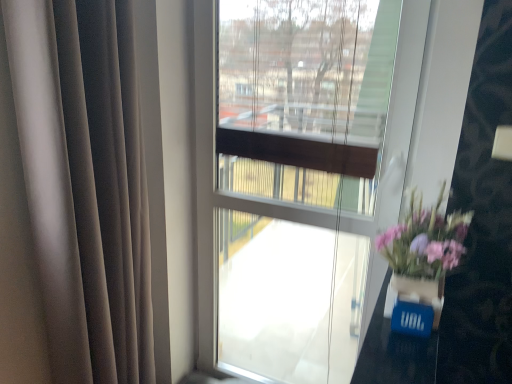
This screenshot has width=512, height=384. Describe the element at coordinates (423, 259) in the screenshot. I see `purple floral bouquet at right` at that location.

You are a GUI agent. You are given a task and a screenshot of the screen. Output one action in this format:
    pyautogui.click(x=<x>, y=<y>)
    Task: Click on the purple floral bouquet at right
    The height and width of the screenshot is (384, 512).
    Given the screenshot: What is the action you would take?
    pyautogui.click(x=423, y=259)

Image resolution: width=512 pixels, height=384 pixels. What do you see at coordinates (416, 295) in the screenshot? I see `blue matte glass vase at lower right` at bounding box center [416, 295].

This screenshot has height=384, width=512. What are the coordinates of `blue matte glass vase at lower right` in the screenshot? It's located at (416, 295).

At what (x,y) coordinates should I click in order to perform the action: click on purple floral bouquet at right. Please return your answer as a coordinate pair (x, y). This screenshot has height=384, width=512. Looking at the image, I should click on (x=423, y=259).

Considering the relative positions of purple floral bouquet at right and blue matte glass vase at lower right in the image provided, is purple floral bouquet at right to the right of blue matte glass vase at lower right from the viewer's perspective?

Yes, purple floral bouquet at right is to the right of blue matte glass vase at lower right.

Relative to blue matte glass vase at lower right, is purple floral bouquet at right in front or behind?

Visually, purple floral bouquet at right is located behind blue matte glass vase at lower right.

Which point is more distant from viewer, (403, 291) or (434, 321)?

Point (403, 291)

From the image's perspective, is purple floral bouquet at right beneath blue matte glass vase at lower right?

No.

From a real-world perspective, relative to blue matte glass vase at lower right, is purple floral bouquet at right vertically above or below?

purple floral bouquet at right is situated higher than blue matte glass vase at lower right in the real world.

Between purple floral bouquet at right and blue matte glass vase at lower right, which one has smaller width?

Thinner between the two is blue matte glass vase at lower right.

Who is taller, purple floral bouquet at right or blue matte glass vase at lower right?

purple floral bouquet at right is taller.

Does purple floral bouquet at right have a larger size compared to blue matte glass vase at lower right?

Yes, purple floral bouquet at right is bigger than blue matte glass vase at lower right.

In the scene shown: Can we say purple floral bouquet at right lies outside blue matte glass vase at lower right?

Yes, purple floral bouquet at right is not within blue matte glass vase at lower right.

Is purple floral bouquet at right far away from blue matte glass vase at lower right?

No, purple floral bouquet at right is not far from blue matte glass vase at lower right.

Is purple floral bouquet at right looking in the opposite direction of blue matte glass vase at lower right?

No, purple floral bouquet at right is not facing the opposite direction of blue matte glass vase at lower right.

What's the angular difference between purple floral bouquet at right and blue matte glass vase at lower right's facing directions?

The facing directions of purple floral bouquet at right and blue matte glass vase at lower right are 0.00192 degrees apart.

Measure the distance between purple floral bouquet at right and blue matte glass vase at lower right.

purple floral bouquet at right and blue matte glass vase at lower right are 3.04 inches apart from each other.

Image resolution: width=512 pixels, height=384 pixels. In order to click on floral arrangement on the right side of blue matte glass vase at lower right in this screenshot , I will do `click(423, 259)`.

Which is more to the right, blue matte glass vase at lower right or purple floral bouquet at right?

purple floral bouquet at right.

Is blue matte glass vase at lower right in front of or behind purple floral bouquet at right in the image?

Visually, blue matte glass vase at lower right is located in front of purple floral bouquet at right.

Which point is more distant from viewer, (419, 295) or (421, 262)?

Positioned behind is point (421, 262).

From the image's perspective, is blue matte glass vase at lower right located above purple floral bouquet at right?

Actually, blue matte glass vase at lower right appears below purple floral bouquet at right in the image.

From a real-world perspective, is blue matte glass vase at lower right beneath purple floral bouquet at right?

Yes, from a real-world perspective, blue matte glass vase at lower right is under purple floral bouquet at right.

Is blue matte glass vase at lower right wider than purple floral bouquet at right?

No, blue matte glass vase at lower right is not wider than purple floral bouquet at right.

Between blue matte glass vase at lower right and purple floral bouquet at right, which one has less height?

blue matte glass vase at lower right.

Considering the sizes of objects blue matte glass vase at lower right and purple floral bouquet at right in the image provided, who is smaller, blue matte glass vase at lower right or purple floral bouquet at right?

blue matte glass vase at lower right is smaller.

Is purple floral bouquet at right a part of blue matte glass vase at lower right?

Definitely not — purple floral bouquet at right is not inside blue matte glass vase at lower right.

Is there a large distance between blue matte glass vase at lower right and purple floral bouquet at right?

blue matte glass vase at lower right is actually quite close to purple floral bouquet at right.

Could you tell me if blue matte glass vase at lower right is turned towards purple floral bouquet at right?

No.

How different are the orientations of blue matte glass vase at lower right and purple floral bouquet at right in degrees?

The angular difference between blue matte glass vase at lower right and purple floral bouquet at right is 0.00192 degrees.

There is a blue matte glass vase at lower right. Where is `floral arrangement above it (from a real-world perspective)`? The width and height of the screenshot is (512, 384). floral arrangement above it (from a real-world perspective) is located at coordinates (423, 259).

I want to click on floral arrangement above the blue matte glass vase at lower right (from the image's perspective), so click(x=423, y=259).

You are a GUI agent. You are given a task and a screenshot of the screen. Output one action in this format:
    pyautogui.click(x=<x>, y=<y>)
    Task: Click on the glass vase on the left of purple floral bouquet at right
    The height and width of the screenshot is (384, 512).
    Given the screenshot: What is the action you would take?
    pyautogui.click(x=416, y=295)